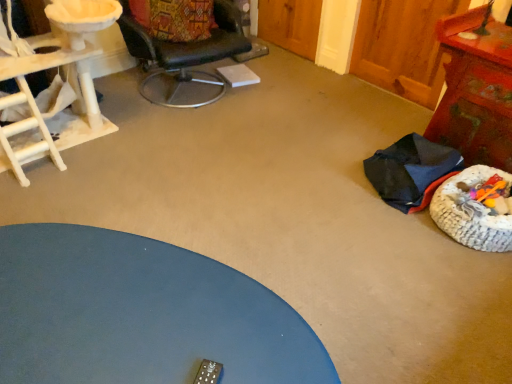
What do you see at coordinates (411, 171) in the screenshot? This screenshot has width=512, height=384. I see `dark blue fabric chair at lower right, marked as the first chair in a right-to-left arrangement` at bounding box center [411, 171].

This screenshot has width=512, height=384. What do you see at coordinates (476, 92) in the screenshot? I see `wooden textured table at right, which appears as the first table when viewed from the top` at bounding box center [476, 92].

In order to click on wooden textured table at right, acting as the 2th table starting from the front in this screenshot , I will do `click(476, 92)`.

At what (x,y) coordinates should I click in order to perform the action: click on dark blue fabric chair at lower right, marked as the first chair in a right-to-left arrangement. Please return your answer as a coordinate pair (x, y). Looking at the image, I should click on (411, 171).

How many degrees apart are the facing directions of blue matte table at lower left, the second table positioned from the top, and wooden textured table at right, which ranks as the 1th table in back-to-front order?

The angle between the facing direction of blue matte table at lower left, the second table positioned from the top, and the facing direction of wooden textured table at right, which ranks as the 1th table in back-to-front order, is 146 degrees.

Does blue matte table at lower left, which appears as the 1th table when viewed from the front, come in front of wooden textured table at right, acting as the first table starting from the right?

Yes, blue matte table at lower left, which appears as the 1th table when viewed from the front, is closer to the camera.

From the picture: Between blue matte table at lower left, which appears as the 1th table when viewed from the front, and wooden textured table at right, acting as the first table starting from the right, which one has larger size?

Bigger between the two is blue matte table at lower left, which appears as the 1th table when viewed from the front.

Which is closer, (x=62, y=355) or (x=497, y=132)?

The point (x=62, y=355) is closer to the camera.

Would you say rustic woven basket at lower right is part of white wood cat tree at left's contents?

That's incorrect, rustic woven basket at lower right is not inside white wood cat tree at left.

Would you consider white wood cat tree at left to be distant from rustic woven basket at lower right?

Yes, white wood cat tree at left and rustic woven basket at lower right are located far from each other.

What are the coordinates of `desk on the left of rustic woven basket at lower right` in the screenshot? It's located at (69, 82).

Can you confirm if white wood cat tree at left is positioned to the left of rustic woven basket at lower right?

Indeed, white wood cat tree at left is positioned on the left side of rustic woven basket at lower right.

Looking at their sizes, would you say black leather chair at upper center, placed as the 2th chair when sorted from right to left, is wider or thinner than rustic woven basket at lower right?

Considering their sizes, black leather chair at upper center, placed as the 2th chair when sorted from right to left, looks broader than rustic woven basket at lower right.

From a real-world perspective, between black leather chair at upper center, the 1th chair from the left, and rustic woven basket at lower right, who is vertically higher?

In real-world perspective, black leather chair at upper center, the 1th chair from the left, is above.

Is black leather chair at upper center, the second chair when ordered from bottom to top, in front of or behind rustic woven basket at lower right in the image?

Clearly, black leather chair at upper center, the second chair when ordered from bottom to top, is behind rustic woven basket at lower right.

From the image's perspective, would you say black leather chair at upper center, the 1th chair from the left, is shown under rustic woven basket at lower right?

No, from the image's perspective, black leather chair at upper center, the 1th chair from the left, is not beneath rustic woven basket at lower right.

How different are the orientations of black leather chair at upper center, which ranks as the 1th chair in top-to-bottom order, and white wood cat tree at left in degrees?

There is a 10.3-degree angle between the facing directions of black leather chair at upper center, which ranks as the 1th chair in top-to-bottom order, and white wood cat tree at left.

Based on their sizes in the image, would you say black leather chair at upper center, which ranks as the 1th chair in top-to-bottom order, is bigger or smaller than white wood cat tree at left?

Considering their sizes, black leather chair at upper center, which ranks as the 1th chair in top-to-bottom order, takes up less space than white wood cat tree at left.

Find the location of `the 2nd chair behind the white wood cat tree at left, counting from the anchor's position`. the 2nd chair behind the white wood cat tree at left, counting from the anchor's position is located at coordinates (185, 55).

In terms of width, does black leather chair at upper center, which ranks as the 1th chair in top-to-bottom order, look wider or thinner when compared to white wood cat tree at left?

black leather chair at upper center, which ranks as the 1th chair in top-to-bottom order, is wider than white wood cat tree at left.

Is black leather chair at upper center, the 1th chair from the left, inside rustic woven basket at lower right?

No, rustic woven basket at lower right does not contain black leather chair at upper center, the 1th chair from the left.

Based on the photo, is rustic woven basket at lower right next to black leather chair at upper center, the 1th chair from the left?

No, rustic woven basket at lower right is not in contact with black leather chair at upper center, the 1th chair from the left.

Looking at this image, from a real-world perspective, is rustic woven basket at lower right below black leather chair at upper center, the second chair when ordered from bottom to top?

Yes, from a real-world perspective, rustic woven basket at lower right is beneath black leather chair at upper center, the second chair when ordered from bottom to top.

Relative to black leather chair at upper center, the second chair when ordered from bottom to top, is rustic woven basket at lower right in front or behind?

rustic woven basket at lower right is in front of black leather chair at upper center, the second chair when ordered from bottom to top.

Between blue matte table at lower left, arranged as the 1th table when ordered from the bottom, and black leather chair at upper center, which ranks as the 1th chair in top-to-bottom order, which one appears on the left side from the viewer's perspective?

black leather chair at upper center, which ranks as the 1th chair in top-to-bottom order, is more to the left.

Which of these two, blue matte table at lower left, arranged as the 1th table when ordered from the bottom, or black leather chair at upper center, the 1th chair from the left, stands taller?

black leather chair at upper center, the 1th chair from the left.

Is black leather chair at upper center, the 1th chair from the left, inside blue matte table at lower left, the second table positioned from the top?

Definitely not — black leather chair at upper center, the 1th chair from the left, is not inside blue matte table at lower left, the second table positioned from the top.

From the image's perspective, which is below, blue matte table at lower left, which is the second table from right to left, or black leather chair at upper center, placed as the 2th chair when sorted from right to left?

blue matte table at lower left, which is the second table from right to left, is shown below in the image.

Which is in front, dark blue fabric chair at lower right, which is the second chair in left-to-right order, or blue matte table at lower left, which appears as the 1th table when viewed from the front?

blue matte table at lower left, which appears as the 1th table when viewed from the front, is more forward.

Are dark blue fabric chair at lower right, marked as the first chair in a right-to-left arrangement, and blue matte table at lower left, which is the second table from right to left, making contact?

No, dark blue fabric chair at lower right, marked as the first chair in a right-to-left arrangement, is not touching blue matte table at lower left, which is the second table from right to left.

How different are the orientations of dark blue fabric chair at lower right, which is the second chair in left-to-right order, and blue matte table at lower left, arranged as the 1th table when ordered from the bottom, in degrees?

The facing directions of dark blue fabric chair at lower right, which is the second chair in left-to-right order, and blue matte table at lower left, arranged as the 1th table when ordered from the bottom, are 57.6 degrees apart.

Measure the distance between dark blue fabric chair at lower right, the second chair when ordered from top to bottom, and blue matte table at lower left, marked as the first table in a left-to-right arrangement.

1.32 meters.

At what (x,y) coordinates should I click in order to perform the action: click on table on the left of the wooden textured table at right, acting as the 2th table starting from the front. Please return your answer as a coordinate pair (x, y). This screenshot has height=384, width=512. Looking at the image, I should click on (140, 314).

Where is `desk above the rustic woven basket at lower right (from a real-world perspective)`? desk above the rustic woven basket at lower right (from a real-world perspective) is located at coordinates (69, 82).

Which object lies nearer to the anchor point blue matte table at lower left, marked as the first table in a left-to-right arrangement, black leather chair at upper center, placed as the 2th chair when sorted from right to left, or rustic woven basket at lower right?

Based on the image, rustic woven basket at lower right appears to be nearer to blue matte table at lower left, marked as the first table in a left-to-right arrangement.

Based on their spatial positions, is dark blue fabric chair at lower right, which is the second chair in left-to-right order, or black leather chair at upper center, the 1th chair from the left, further from blue matte table at lower left, which appears as the 1th table when viewed from the front?

Based on the image, black leather chair at upper center, the 1th chair from the left, appears to be further to blue matte table at lower left, which appears as the 1th table when viewed from the front.

Based on their spatial positions, is white wood cat tree at left or rustic woven basket at lower right closer to black leather chair at upper center, the 1th chair from the left?

white wood cat tree at left.

Considering their positions, is wooden textured table at right, acting as the 2th table starting from the front, positioned closer to black leather chair at upper center, placed as the 2th chair when sorted from right to left, than blue matte table at lower left, which appears as the 1th table when viewed from the front?

wooden textured table at right, acting as the 2th table starting from the front, lies closer to black leather chair at upper center, placed as the 2th chair when sorted from right to left, than the other object.

Based on their spatial positions, is black leather chair at upper center, the second chair when ordered from bottom to top, or rustic woven basket at lower right closer to wooden textured table at right, which appears as the first table when viewed from the top?

rustic woven basket at lower right.

Considering their positions, is black leather chair at upper center, the second chair when ordered from bottom to top, positioned closer to rustic woven basket at lower right than dark blue fabric chair at lower right, which is the second chair in left-to-right order?

Among the two, dark blue fabric chair at lower right, which is the second chair in left-to-right order, is located nearer to rustic woven basket at lower right.

Considering their positions, is blue matte table at lower left, which is the second table from right to left, positioned further to black leather chair at upper center, placed as the 2th chair when sorted from right to left, than rustic woven basket at lower right?

blue matte table at lower left, which is the second table from right to left, is positioned further to the anchor black leather chair at upper center, placed as the 2th chair when sorted from right to left.

Looking at the image, which one is located further to white wood cat tree at left, dark blue fabric chair at lower right, the first chair when ordered from bottom to top, or wooden textured table at right, acting as the 2th table starting from the front?

wooden textured table at right, acting as the 2th table starting from the front, is positioned further to the anchor white wood cat tree at left.

Where is `dog bed between white wood cat tree at left and wooden textured table at right, which ranks as the 1th table in back-to-front order`? This screenshot has height=384, width=512. dog bed between white wood cat tree at left and wooden textured table at right, which ranks as the 1th table in back-to-front order is located at coordinates (471, 212).

Where is `chair that lies between black leather chair at upper center, the second chair when ordered from bottom to top, and blue matte table at lower left, which is the second table from right to left, from top to bottom`? The image size is (512, 384). chair that lies between black leather chair at upper center, the second chair when ordered from bottom to top, and blue matte table at lower left, which is the second table from right to left, from top to bottom is located at coordinates (411, 171).

Image resolution: width=512 pixels, height=384 pixels. I want to click on table between black leather chair at upper center, the second chair when ordered from bottom to top, and wooden textured table at right, which is counted as the 2th table, starting from the bottom, from left to right, so click(140, 314).

You are a GUI agent. You are given a task and a screenshot of the screen. Output one action in this format:
    pyautogui.click(x=<x>, y=<y>)
    Task: Click on the table between white wood cat tree at left and dark blue fabric chair at lower right, the first chair when ordered from bottom to top, in the horizontal direction
    
    Given the screenshot: What is the action you would take?
    pyautogui.click(x=140, y=314)